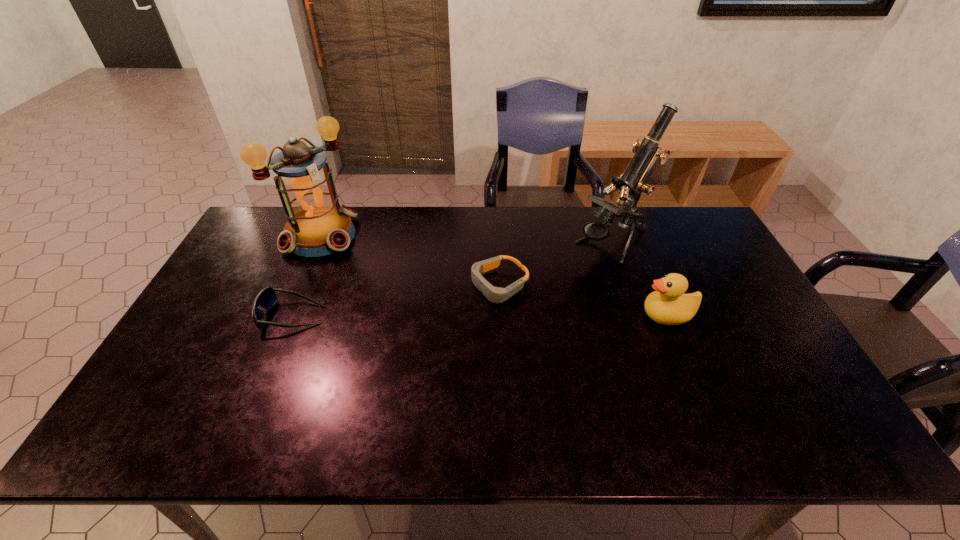
In order to click on free space that is in between the microscope and the second tallest object in this screenshot , I will do point(467,239).

What are the coordinates of `vacant space that's between the microscope and the goggles` in the screenshot? It's located at (557, 264).

Locate an element on the screen. object that ranks as the second closest to the third object from left to right is located at coordinates (668, 305).

Identify the location of object identified as the third closest to the sunglasses. Image resolution: width=960 pixels, height=540 pixels. (631, 183).

Locate an element on the screen. free region that satisfies the following two spatial constraints: 1. on the front side of the lantern; 2. at the beak of the third shortest object is located at coordinates (286, 315).

In order to click on free space that satisfies the following two spatial constraints: 1. on the front side of the second tallest object; 2. at the beak of the duck in this screenshot , I will do `click(286, 315)`.

Image resolution: width=960 pixels, height=540 pixels. What are the coordinates of `vacant region that satisfies the following two spatial constraints: 1. on the front side of the second tallest object; 2. on the front-facing side of the sunglasses` in the screenshot? It's located at (286, 315).

Find the location of a particular element. blank area in the image that satisfies the following two spatial constraints: 1. on the front side of the duck; 2. at the beak of the goggles is located at coordinates (501, 315).

Where is `vacant space that satisfies the following two spatial constraints: 1. on the front side of the shortest object; 2. at the beak of the duck`? This screenshot has height=540, width=960. vacant space that satisfies the following two spatial constraints: 1. on the front side of the shortest object; 2. at the beak of the duck is located at coordinates (501, 315).